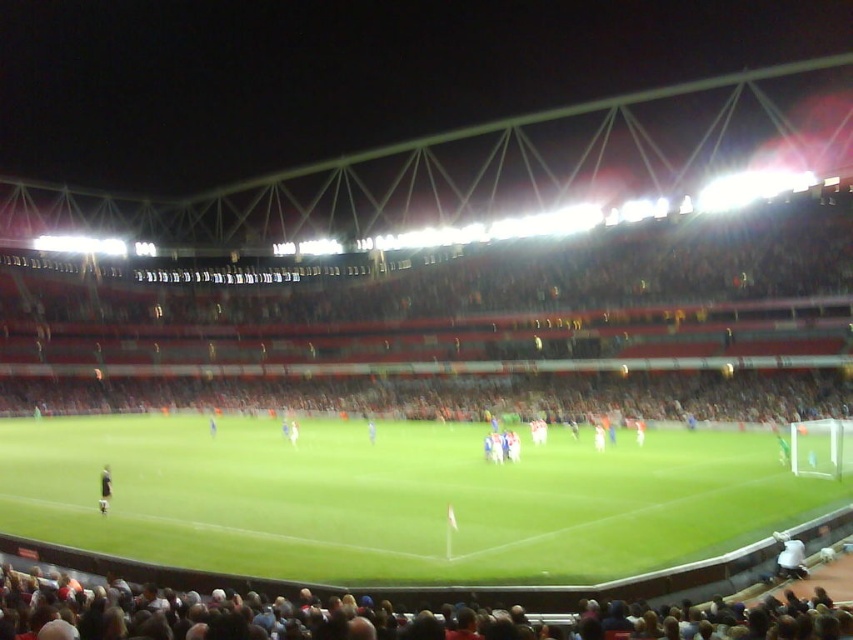
Question: Which of these objects is positioned farthest from the white fabric at lower right?

Choices:
 (A) white fabric person at center
 (B) dark green jersey at center

Answer: (A)

Question: Does dark brown hair at lower center appear under white fabric at lower right?

Choices:
 (A) yes
 (B) no

Answer: (B)

Question: Which of these objects is positioned closest to the green grass football field at center?

Choices:
 (A) white fabric at lower right
 (B) white fabric person at center
 (C) dark green jersey at center
 (D) dark brown hair at lower center

Answer: (D)

Question: Which point is farther to the camera?

Choices:
 (A) dark green jersey at center
 (B) dark brown hair at lower center

Answer: (A)

Question: In this image, where is white fabric at lower right located relative to dark green jersey at center?

Choices:
 (A) below
 (B) above

Answer: (B)

Question: Does green grass football field at center have a larger size compared to dark brown hair at lower center?

Choices:
 (A) yes
 (B) no

Answer: (A)